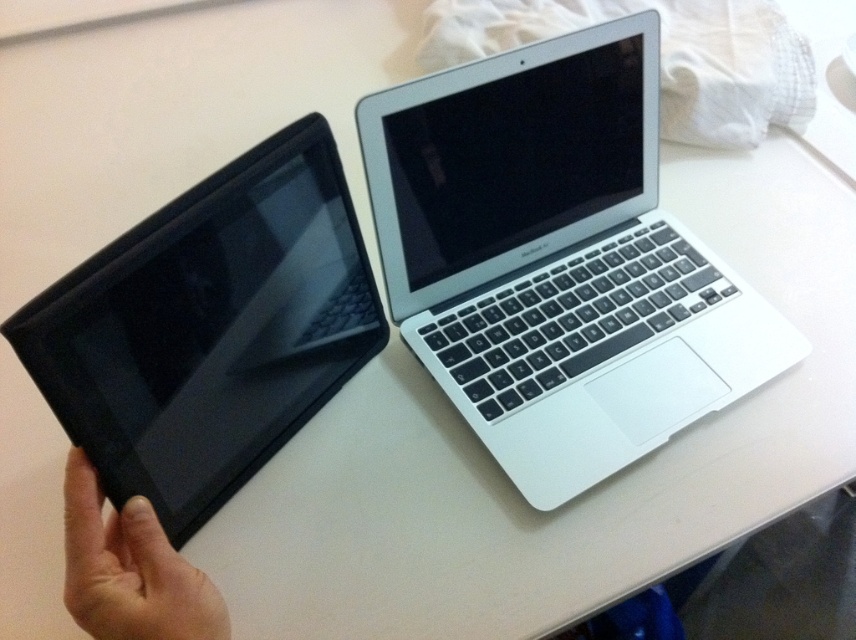
Who is positioned more to the right, silver metallic laptop at upper right or skinny flesh-toned hand at lower left?

Positioned to the right is silver metallic laptop at upper right.

Who is shorter, silver metallic laptop at upper right or skinny flesh-toned hand at lower left?

Answer: Standing shorter between the two is skinny flesh-toned hand at lower left.

This screenshot has width=856, height=640. Identify the location of silver metallic laptop at upper right. (556, 259).

Is silver metallic laptop at upper right further to the viewer compared to black matte tablet at left?

Yes, it is behind black matte tablet at left.

I want to click on silver metallic laptop at upper right, so click(556, 259).

Find the location of a particular element. This screenshot has width=856, height=640. silver metallic laptop at upper right is located at coordinates [x=556, y=259].

Who is taller, black matte tablet at left or skinny flesh-toned hand at lower left?

black matte tablet at left is taller.

I want to click on black matte tablet at left, so click(x=209, y=328).